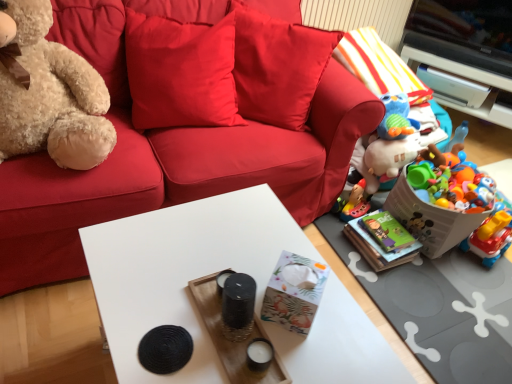
Question: Is velvet red couch at center beside plastic toy basket at lower right, the 2th box viewed from the left?

Choices:
 (A) yes
 (B) no

Answer: (B)

Question: Is plastic toy basket at lower right, placed as the first box when sorted from back to front, a part of velvet red couch at center?

Choices:
 (A) yes
 (B) no

Answer: (B)

Question: Does velvet red couch at center lie behind plastic toy basket at lower right, placed as the first box when sorted from right to left?

Choices:
 (A) no
 (B) yes

Answer: (A)

Question: Is velvet red couch at center shorter than plastic toy basket at lower right, placed as the first box when sorted from back to front?

Choices:
 (A) yes
 (B) no

Answer: (B)

Question: Is velvet red couch at center wider than plastic toy basket at lower right, the 2th box viewed from the left?

Choices:
 (A) no
 (B) yes

Answer: (B)

Question: From a real-world perspective, is white matte table at center positioned above or below plastic toy basket at lower right, the 2th box viewed from the left?

Choices:
 (A) below
 (B) above

Answer: (B)

Question: Is point (120, 258) positioned closer to the camera than point (477, 213)?

Choices:
 (A) closer
 (B) farther

Answer: (A)

Question: From their relative heights in the image, would you say white matte table at center is taller or shorter than plastic toy basket at lower right, which appears as the second box when viewed from the front?

Choices:
 (A) tall
 (B) short

Answer: (A)

Question: Do you think white matte table at center is within plastic toy basket at lower right, the 2th box viewed from the left, or outside of it?

Choices:
 (A) outside
 (B) inside

Answer: (A)

Question: Relative to white glossy cabinet at upper right, is fuzzy beige teddy bear at left in front or behind?

Choices:
 (A) behind
 (B) front

Answer: (B)

Question: In the image, is fuzzy beige teddy bear at left on the left side or the right side of white glossy cabinet at upper right?

Choices:
 (A) left
 (B) right

Answer: (A)

Question: Does point [100, 114] appear closer or farther from the camera than point [451, 64]?

Choices:
 (A) closer
 (B) farther

Answer: (A)

Question: Is fuzzy beige teddy bear at left taller or shorter than white glossy cabinet at upper right?

Choices:
 (A) short
 (B) tall

Answer: (B)

Question: Is plastic colorful toys at right, the second toy positioned from the back, inside or outside of velvet red couch at center?

Choices:
 (A) outside
 (B) inside

Answer: (A)

Question: Is plastic colorful toys at right, the second toy positioned from the back, in front of or behind velvet red couch at center in the image?

Choices:
 (A) behind
 (B) front

Answer: (A)